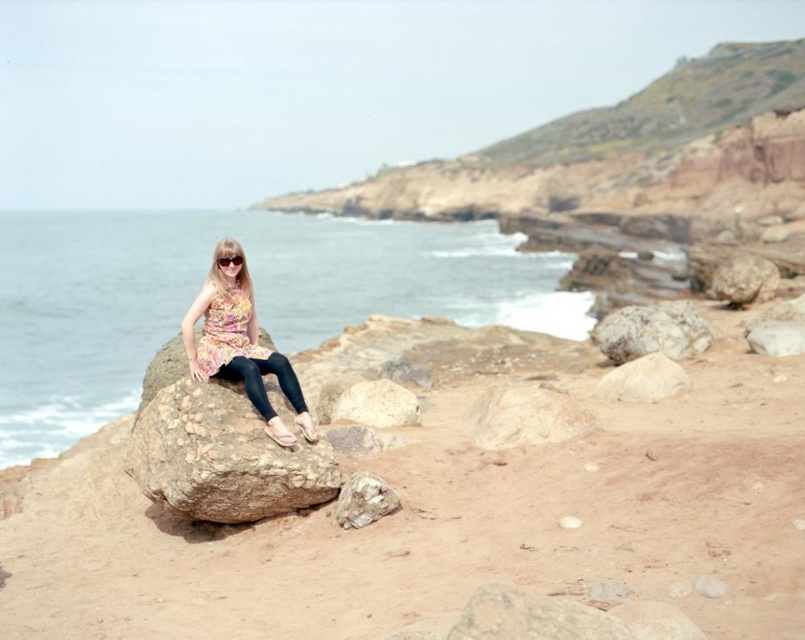
You are a photographer trying to capture the woman in the floral dress. To ensure the smooth gray rock at center is in the background, where should you position yourself relative to the point marked by coordinates point (362, 500)?

To have the smooth gray rock at center in the background, position yourself behind the point marked by coordinates point (362, 500) so that the rock is farther away from the camera.

You are a hiker who wants to climb up to the top of the brown rough boulder at center. You see the smooth gray rock at center nearby. Which rock should you step on first to reach the top?

You should step on the smooth gray rock at center first because the brown rough boulder at center is located above it, so the smooth gray rock is the lower one and the starting point for climbing.